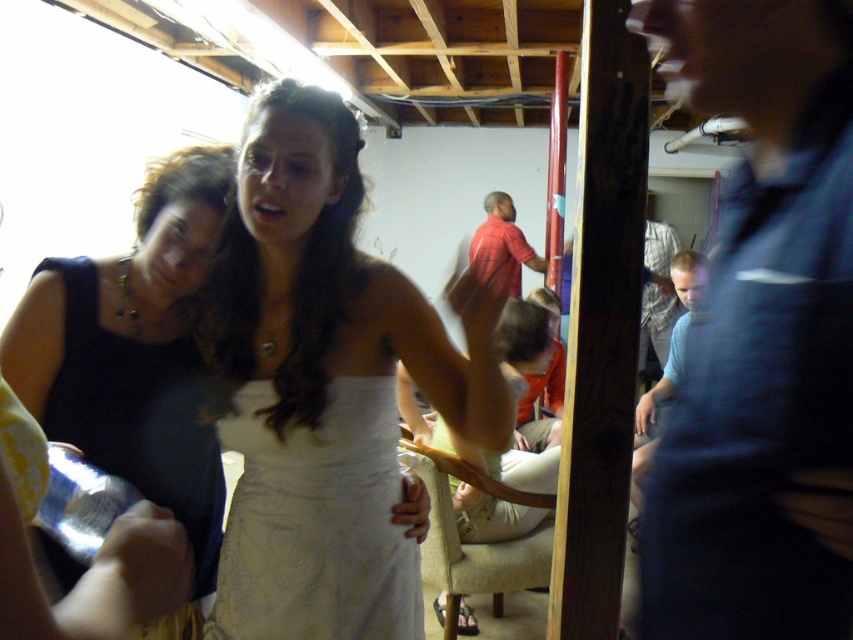
The height and width of the screenshot is (640, 853). In order to click on white satin dress at center in this screenshot , I will do `click(323, 385)`.

Based on the photo, who is more forward, (453, 388) or (297, 445)?

Point (297, 445) is more forward.

What are the coordinates of `white satin dress at center` in the screenshot? It's located at (323, 385).

Which is more to the left, white satin dress at center or black satin dress at left?

From the viewer's perspective, black satin dress at left appears more on the left side.

Is white satin dress at center closer to the viewer compared to black satin dress at left?

That is True.

Image resolution: width=853 pixels, height=640 pixels. What are the coordinates of `white satin dress at center` in the screenshot? It's located at (323, 385).

Between point (704, 525) and point (672, 234), which one is positioned behind?

The point (672, 234) is more distant.

This screenshot has width=853, height=640. What do you see at coordinates (761, 337) in the screenshot? I see `blue cotton shirt at right` at bounding box center [761, 337].

The image size is (853, 640). Find the location of `blue cotton shirt at right`. blue cotton shirt at right is located at coordinates (761, 337).